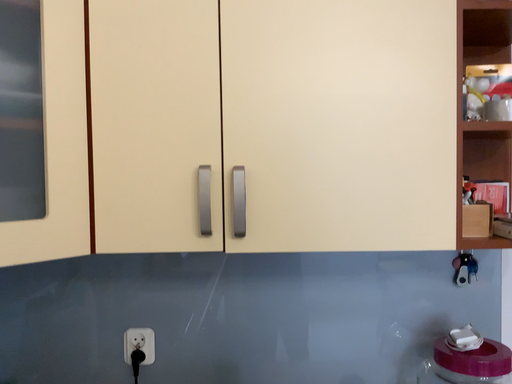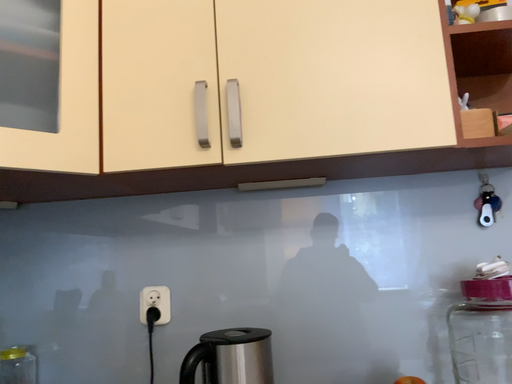
Question: Which way did the camera rotate in the video?

Choices:
 (A) rotated upward
 (B) rotated downward

Answer: (A)